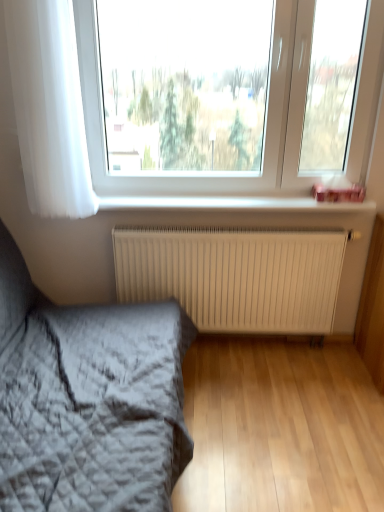
Image resolution: width=384 pixels, height=512 pixels. What do you see at coordinates (233, 204) in the screenshot?
I see `white plastic window sill at upper center` at bounding box center [233, 204].

What is the approximate width of textured gray quilt at lower left?

textured gray quilt at lower left is 1.14 meters in width.

Describe the element at coordinates (88, 400) in the screenshot. I see `textured gray quilt at lower left` at that location.

What are the coordinates of `white sheer curtain at left` in the screenshot? It's located at (49, 106).

At what (x,y) coordinates should I click in order to perform the action: click on white matte radiator at center. Please return your answer as a coordinate pair (x, y). The width and height of the screenshot is (384, 512). Looking at the image, I should click on (235, 277).

From the image's perspective, is textured gray quilt at lower left over white plastic window at upper center?

Actually, textured gray quilt at lower left appears below white plastic window at upper center in the image.

Identify the location of bed on the left of white plastic window at upper center. (88, 400).

Between textured gray quilt at lower left and white plastic window at upper center, which one has larger width?

textured gray quilt at lower left.

Based on their positions, is textured gray quilt at lower left located to the left or right of white plastic window at upper center?

Clearly, textured gray quilt at lower left is on the left of white plastic window at upper center in the image.

Is white plastic window sill at upper center taller or shorter than white matte radiator at center?

white plastic window sill at upper center is shorter than white matte radiator at center.

Is white plastic window sill at upper center not close to white matte radiator at center?

No, white plastic window sill at upper center is not far from white matte radiator at center.

You are a GUI agent. You are given a task and a screenshot of the screen. Output one action in this format:
    pyautogui.click(x=<x>, y=<y>)
    Task: Click on the window sill above the white matte radiator at center (from the image's perspective)
    
    Given the screenshot: What is the action you would take?
    pyautogui.click(x=233, y=204)

Does point (290, 199) appear closer or farther from the camera than point (235, 291)?

Clearly, point (290, 199) is closer to the camera than point (235, 291).

Does white matte radiator at center have a lesser width compared to white plastic window at upper center?

Yes, white matte radiator at center is thinner than white plastic window at upper center.

Is white matte radiator at center far from white plastic window at upper center?

No, there isn't a large distance between white matte radiator at center and white plastic window at upper center.

Is white matte radiator at center bigger or smaller than white plastic window at upper center?

Clearly, white matte radiator at center is smaller in size than white plastic window at upper center.

In the image, is textured gray quilt at lower left positioned in front of or behind white plastic window sill at upper center?

In the image, textured gray quilt at lower left appears in front of white plastic window sill at upper center.

Considering the sizes of textured gray quilt at lower left and white plastic window sill at upper center in the image, is textured gray quilt at lower left taller or shorter than white plastic window sill at upper center?

textured gray quilt at lower left is taller than white plastic window sill at upper center.

From a real-world perspective, is textured gray quilt at lower left physically below white plastic window sill at upper center?

Correct, in the physical world, textured gray quilt at lower left is lower than white plastic window sill at upper center.

Is textured gray quilt at lower left wider than white plastic window sill at upper center?

Correct, the width of textured gray quilt at lower left exceeds that of white plastic window sill at upper center.

From the picture: From the image's perspective, is white matte radiator at center below white plastic window sill at upper center?

Yes, from the image's perspective, white matte radiator at center is beneath white plastic window sill at upper center.

Considering the relative positions of white matte radiator at center and white plastic window sill at upper center in the image provided, is white matte radiator at center in front of white plastic window sill at upper center?

No.

From a real-world perspective, who is located lower, white matte radiator at center or white plastic window sill at upper center?

In real-world perspective, white matte radiator at center is lower.

Is point (310, 244) closer to viewer compared to point (211, 207)?

That is True.

Does white plastic window sill at upper center come behind textured gray quilt at lower left?

Yes.

Does white plastic window sill at upper center turn towards textured gray quilt at lower left?

No, white plastic window sill at upper center is not oriented towards textured gray quilt at lower left.

Is white plastic window sill at upper center to the left of textured gray quilt at lower left from the viewer's perspective?

No, white plastic window sill at upper center is not to the left of textured gray quilt at lower left.

Considering the sizes of objects white plastic window sill at upper center and textured gray quilt at lower left in the image provided, who is shorter, white plastic window sill at upper center or textured gray quilt at lower left?

Standing shorter between the two is white plastic window sill at upper center.

In the scene shown: Between white plastic window sill at upper center and white plastic window at upper center, which one appears on the left side from the viewer's perspective?

white plastic window at upper center.

Is white plastic window sill at upper center not within white plastic window at upper center?

Indeed, white plastic window sill at upper center is completely outside white plastic window at upper center.

From the image's perspective, does white plastic window sill at upper center appear lower than white plastic window at upper center?

Yes, from the image's perspective, white plastic window sill at upper center is beneath white plastic window at upper center.

The width and height of the screenshot is (384, 512). Identify the location of window on the left of white plastic window sill at upper center. (266, 124).

Locate an element on the screen. The image size is (384, 512). bed beneath the white plastic window at upper center (from a real-world perspective) is located at coordinates (88, 400).

You are a GUI agent. You are given a task and a screenshot of the screen. Output one action in this format:
    pyautogui.click(x=<x>, y=<y>)
    Task: Click on the window sill in front of the white matte radiator at center
    This screenshot has width=384, height=512.
    Given the screenshot: What is the action you would take?
    pyautogui.click(x=233, y=204)

Looking at the image, which one is located closer to white plastic window at upper center, white matte radiator at center or white plastic window sill at upper center?

white plastic window sill at upper center is positioned closer to the anchor white plastic window at upper center.

Looking at the image, which one is located closer to textured gray quilt at lower left, white plastic window sill at upper center or white sheer curtain at left?

white sheer curtain at left lies closer to textured gray quilt at lower left than the other object.

Considering their positions, is white matte radiator at center positioned closer to white sheer curtain at left than white plastic window sill at upper center?

white plastic window sill at upper center lies closer to white sheer curtain at left than the other object.

Based on their spatial positions, is white matte radiator at center or textured gray quilt at lower left closer to white plastic window at upper center?

white matte radiator at center is closer to white plastic window at upper center.

Looking at the image, which one is located closer to textured gray quilt at lower left, white sheer curtain at left or white matte radiator at center?

white matte radiator at center is positioned closer to the anchor textured gray quilt at lower left.

Estimate the real-world distances between objects in this image. Which object is closer to white sheer curtain at left, textured gray quilt at lower left or white plastic window sill at upper center?

white plastic window sill at upper center.

From the picture: Looking at the image, which one is located closer to white matte radiator at center, white plastic window at upper center or textured gray quilt at lower left?

white plastic window at upper center.

Considering their positions, is white sheer curtain at left positioned closer to white matte radiator at center than white plastic window sill at upper center?

white plastic window sill at upper center is closer to white matte radiator at center.

At what (x,y) coordinates should I click in order to perform the action: click on curtain between textured gray quilt at lower left and white plastic window at upper center from front to back. Please return your answer as a coordinate pair (x, y). Image resolution: width=384 pixels, height=512 pixels. Looking at the image, I should click on (x=49, y=106).

Where is `window positioned between textured gray quilt at lower left and white matte radiator at center from near to far`? window positioned between textured gray quilt at lower left and white matte radiator at center from near to far is located at coordinates (266, 124).

At what (x,y) coordinates should I click in order to perform the action: click on curtain between textured gray quilt at lower left and white plastic window sill at upper center in the front-back direction. Please return your answer as a coordinate pair (x, y). The height and width of the screenshot is (512, 384). Looking at the image, I should click on (49, 106).

Identify the location of curtain between textured gray quilt at lower left and white matte radiator at center from front to back. This screenshot has width=384, height=512. (49, 106).